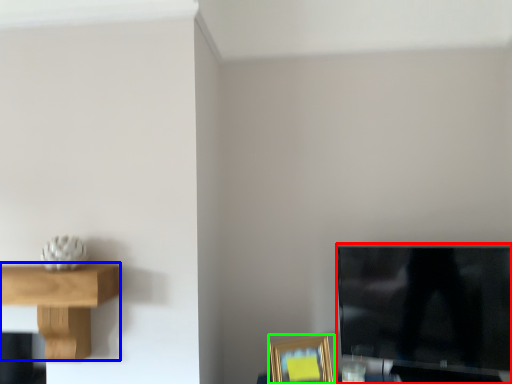
Question: Which object is the farthest from television (highlighted by a red box)? Choose among these: shelf (highlighted by a blue box) or picture frame (highlighted by a green box).

Choices:
 (A) shelf
 (B) picture frame

Answer: (A)